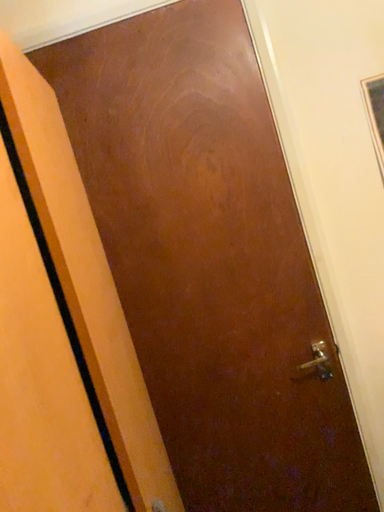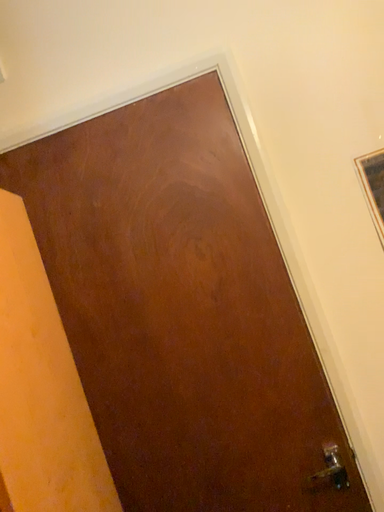
Question: Which way did the camera rotate in the video?

Choices:
 (A) rotated downward
 (B) rotated upward

Answer: (B)